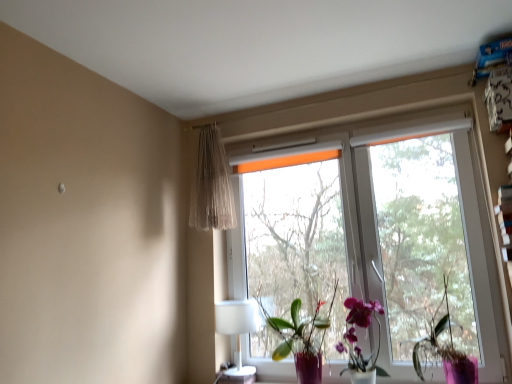
Question: Does transparent glass window at center touch white plastic table lamp at lower center?

Choices:
 (A) no
 (B) yes

Answer: (A)

Question: From the image's perspective, is transparent glass window at center on top of white plastic table lamp at lower center?

Choices:
 (A) yes
 (B) no

Answer: (A)

Question: Is transparent glass window at center oriented away from white plastic table lamp at lower center?

Choices:
 (A) yes
 (B) no

Answer: (A)

Question: Can you confirm if transparent glass window at center is smaller than white plastic table lamp at lower center?

Choices:
 (A) no
 (B) yes

Answer: (A)

Question: Is the depth of transparent glass window at center greater than that of white plastic table lamp at lower center?

Choices:
 (A) yes
 (B) no

Answer: (B)

Question: Considering the relative sizes of transparent glass window at center and white plastic table lamp at lower center in the image provided, is transparent glass window at center taller than white plastic table lamp at lower center?

Choices:
 (A) yes
 (B) no

Answer: (A)

Question: Considering the relative positions of purple matte plant at right, acting as the 2th houseplant starting from the left, and translucent glass vase with orchids at center in the image provided, is purple matte plant at right, acting as the 2th houseplant starting from the left, behind translucent glass vase with orchids at center?

Choices:
 (A) yes
 (B) no

Answer: (B)

Question: Is purple matte plant at right, the first houseplant positioned from the right, surrounding translucent glass vase with orchids at center?

Choices:
 (A) no
 (B) yes

Answer: (A)

Question: Considering the relative sizes of purple matte plant at right, the first houseplant positioned from the right, and translucent glass vase with orchids at center in the image provided, is purple matte plant at right, the first houseplant positioned from the right, shorter than translucent glass vase with orchids at center?

Choices:
 (A) no
 (B) yes

Answer: (A)

Question: Is purple matte plant at right, acting as the 2th houseplant starting from the left, at the left side of translucent glass vase with orchids at center?

Choices:
 (A) yes
 (B) no

Answer: (B)

Question: Is purple matte plant at right, the first houseplant positioned from the right, oriented away from translucent glass vase with orchids at center?

Choices:
 (A) yes
 (B) no

Answer: (B)

Question: From the image's perspective, is purple matte plant at right, the first houseplant positioned from the right, on top of translucent glass vase with orchids at center?

Choices:
 (A) yes
 (B) no

Answer: (A)

Question: Does transparent glass window at center have a larger size compared to orange fabric tree at center?

Choices:
 (A) yes
 (B) no

Answer: (A)